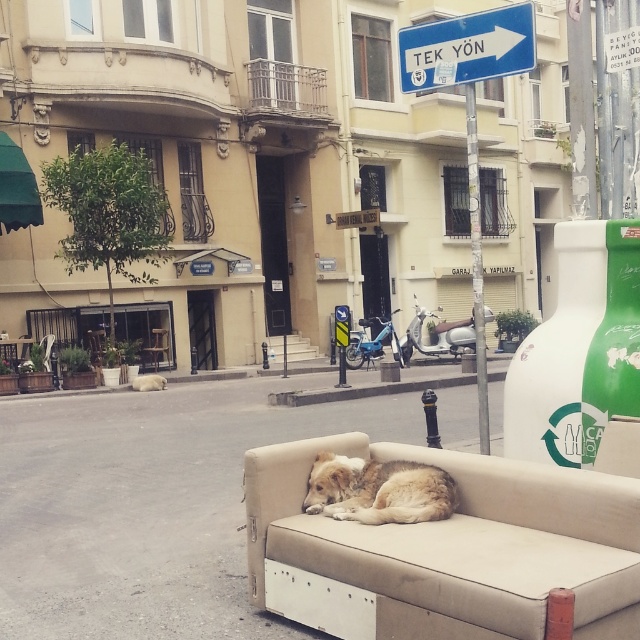
You are standing in the European city street scene and want to take a photo of the beige sofa with the dog. You notice two points marked in the image. Which point is closer to you, point (461,26) or point (332,394)?

Point (461,26) is closer to the viewer than point (332,394).

In the scene shown: You are a tourist in this European city and want to take a photo of the blue plastic sign at upper center without including the gray concrete curb at center in the frame. Which direction should you move to achieve this?

Move to the left so that the blue plastic sign at upper center is no longer next to the gray concrete curb at center.